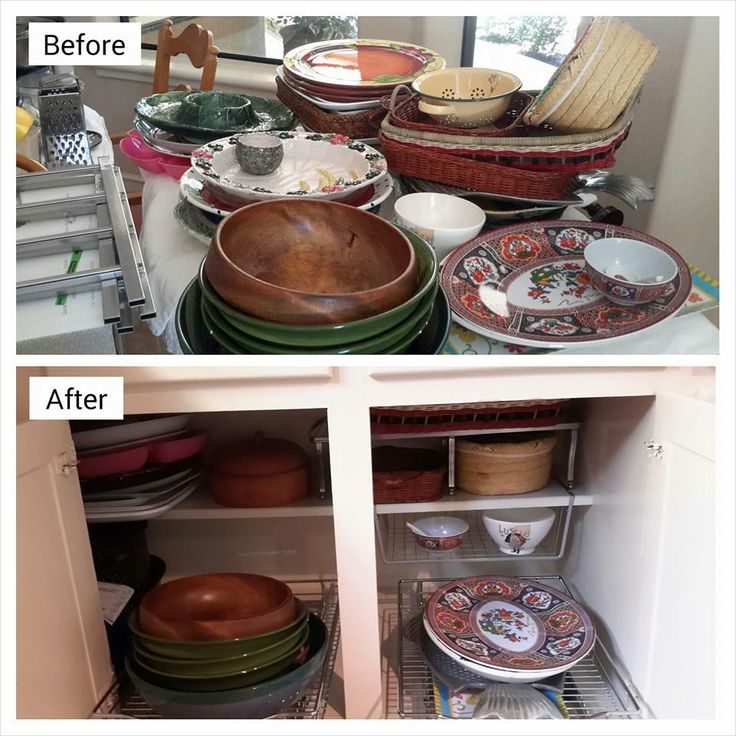
I want to click on plant(s), so coord(322,21), coord(542,35).